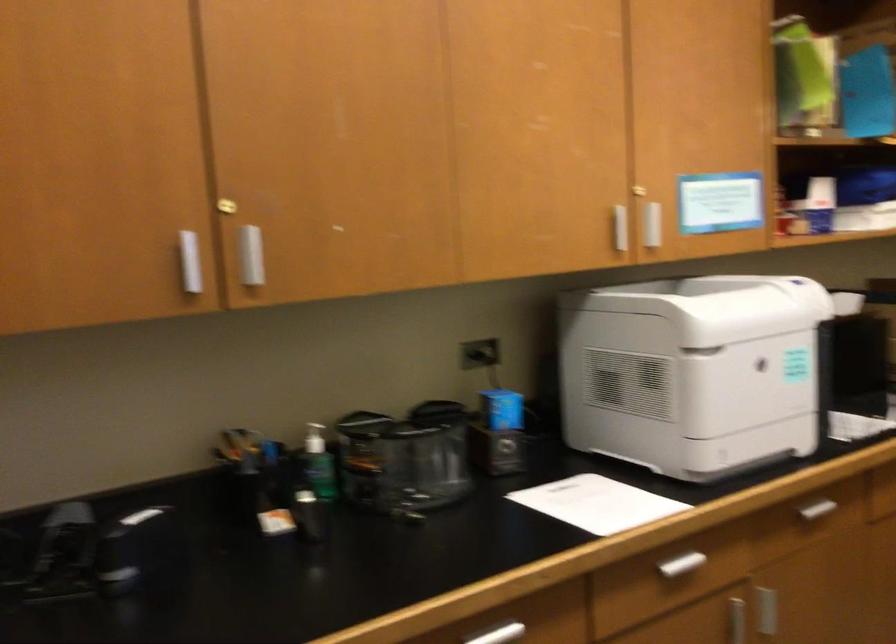
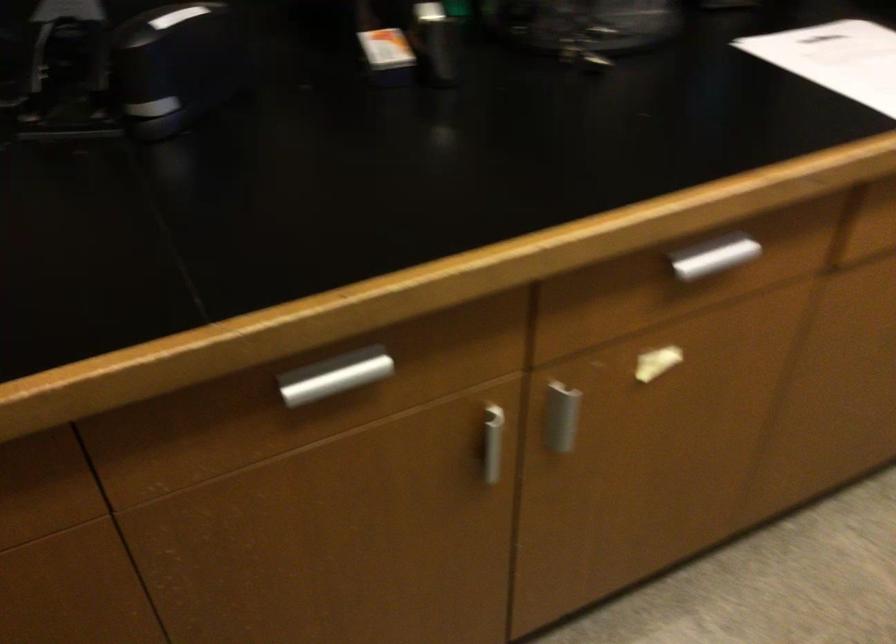
Locate, in the second image, the point that corresponds to point 273,526 in the first image.

(386, 57)